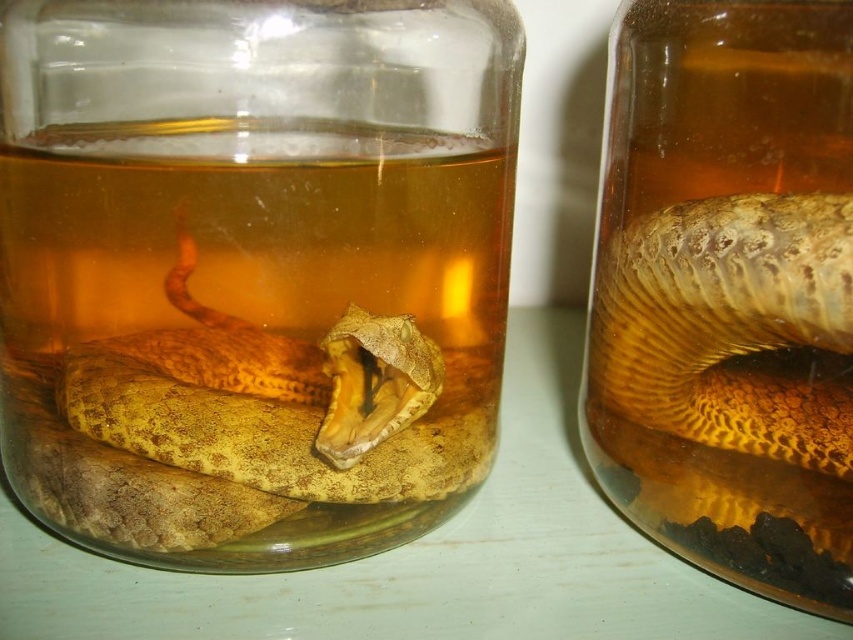
Which is above, translucent glass jar at center or translucent amber liquid at right?

translucent glass jar at center is higher up.

Is translucent glass jar at center closer to camera compared to translucent amber liquid at right?

That is True.

Who is more distant from viewer, (132, 10) or (770, 102)?

Point (770, 102)

The image size is (853, 640). I want to click on translucent glass jar at center, so click(251, 268).

Which of these two, yellow scaly snake at right or yellow scaly snake at center, stands shorter?

yellow scaly snake at center

Is point (848, 204) positioned behind point (351, 394)?

No, (848, 204) is in front of (351, 394).

The height and width of the screenshot is (640, 853). I want to click on yellow scaly snake at right, so click(730, 324).

Does point (375, 275) come closer to viewer compared to point (767, 394)?

Yes, point (375, 275) is closer to viewer.

Who is taller, translucent glass jar at center or yellow scaly snake at right?

translucent glass jar at center

Does point (488, 323) come behind point (679, 406)?

Yes.

You are a GUI agent. You are given a task and a screenshot of the screen. Output one action in this format:
    pyautogui.click(x=<x>, y=<y>)
    Task: Click on the translucent glass jar at center
    The width and height of the screenshot is (853, 640).
    Given the screenshot: What is the action you would take?
    pyautogui.click(x=251, y=268)